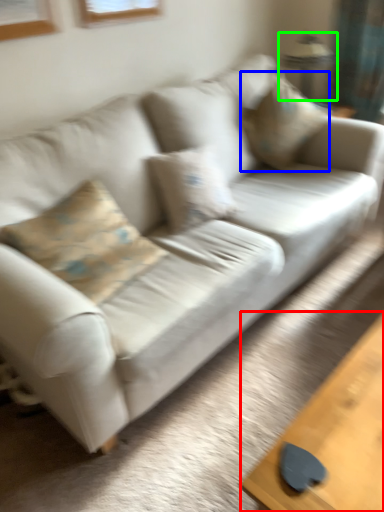
Question: Considering the real-world distances, which object is closest to table (highlighted by a red box)? pillow (highlighted by a blue box) or lamp (highlighted by a green box).

Choices:
 (A) pillow
 (B) lamp

Answer: (A)